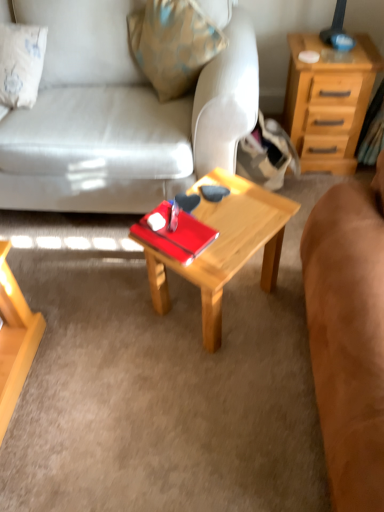
I want to click on free space below wooden coffee table at center (from a real-world perspective), so click(235, 301).